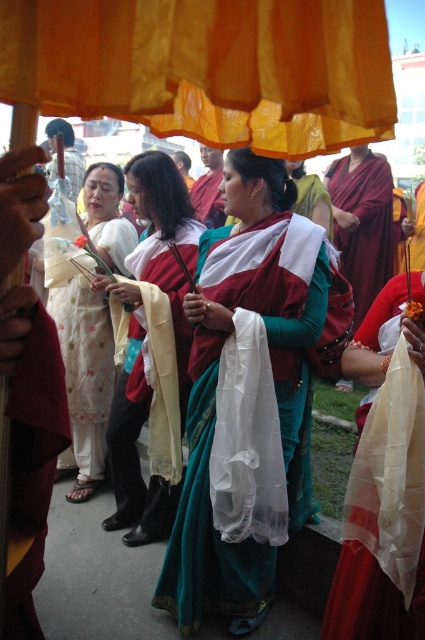
Question: From the image, what is the correct spatial relationship of green silk saree at center in relation to maroon velvet robe at center?

Choices:
 (A) below
 (B) above

Answer: (A)

Question: Which point is farther from the camera taking this photo?

Choices:
 (A) (121, 508)
 (B) (206, 179)
 (C) (368, 225)
 (D) (272, 438)

Answer: (B)

Question: Can you confirm if white sheer cloth at center is wider than white embroidered dress at center?

Choices:
 (A) yes
 (B) no

Answer: (B)

Question: Which of these objects is positioned farthest from the smooth brown monk at upper left?

Choices:
 (A) white embroidered dress at center
 (B) green silk saree at center
 (C) matte white scarf at center

Answer: (B)

Question: Among these objects, which one is farthest from the camera?

Choices:
 (A) white embroidered dress at center
 (B) maroon silk robe at center
 (C) green silk saree at center
 (D) matte white scarf at center

Answer: (B)

Question: In this image, where is green silk saree at center located relative to white embroidered dress at center?

Choices:
 (A) above
 (B) below

Answer: (A)